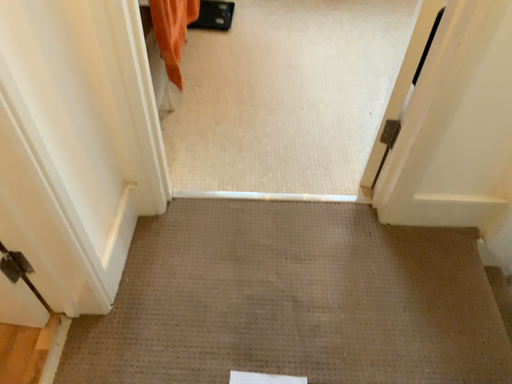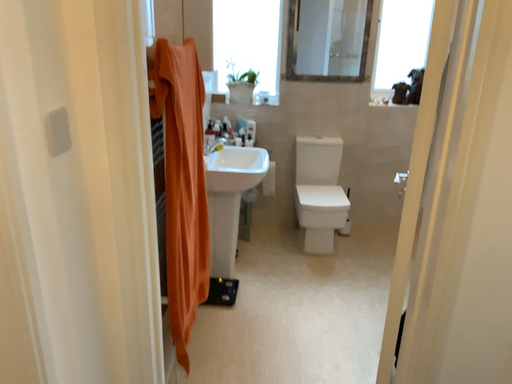
Question: How did the camera likely rotate when shooting the video?

Choices:
 (A) rotated upward
 (B) rotated downward

Answer: (A)